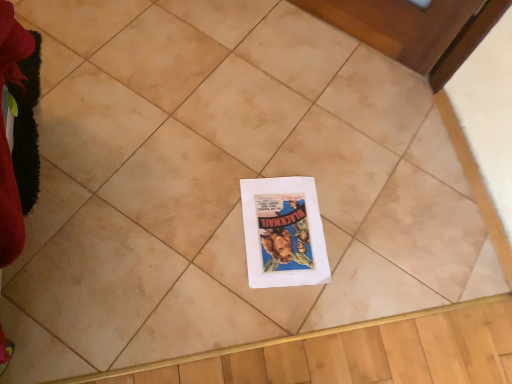
At what (x,y) coordinates should I click in order to perform the action: click on blank space to the left of white paper flyer at center. Please return your answer as a coordinate pair (x, y). This screenshot has width=512, height=384. Looking at the image, I should click on (200, 207).